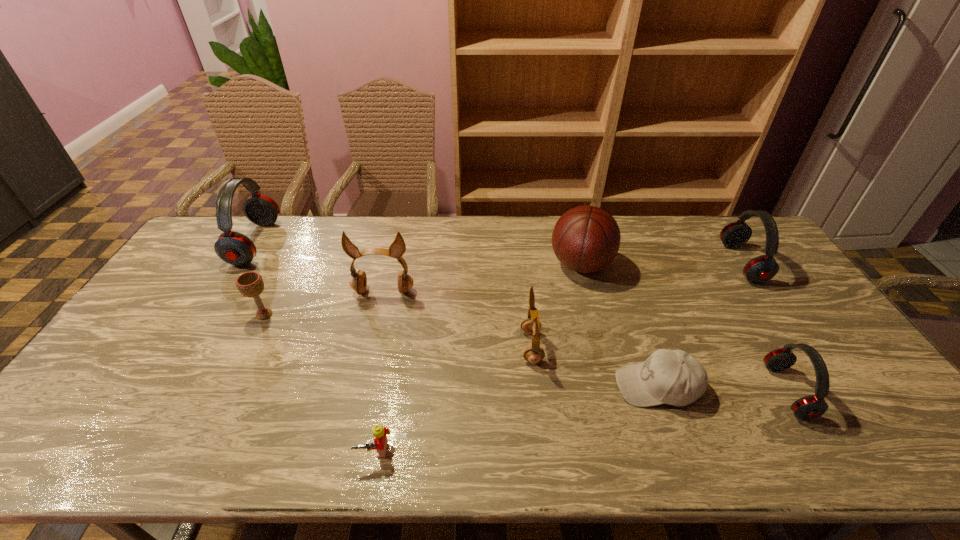
Identify the location of vacant area that lies between the Lego and the second earphone from left to right. (379, 371).

I want to click on the fourth closest object to the basketball, so pyautogui.click(x=809, y=407).

Identify the location of object that is the closest to the rightmost red earphone. The height and width of the screenshot is (540, 960). (809, 407).

Locate an element on the screen. earphone that is the second nearest to the brown basketball is located at coordinates (760, 269).

What are the coordinates of `the second closest earphone to the fifth object from right to left` in the screenshot? It's located at (809, 407).

Locate an element on the screen. The image size is (960, 540). red earphone that is the closest to the leftmost red earphone is located at coordinates (809, 407).

Point out which red earphone is positioned as the second nearest to the left brown earphone. Please provide its 2D coordinates. Your answer should be formatted as a tuple, i.e. [(x, y)], where the tuple contains the x and y coordinates of a point satisfying the conditions above.

[(809, 407)]

This screenshot has width=960, height=540. I want to click on vacant area that satisfies the following two spatial constraints: 1. on the ear cups of the basketball; 2. on the left side of the leftmost object, so click(242, 265).

Where is `free space in the image that satisfies the following two spatial constraints: 1. on the front side of the brown basketball; 2. on the front-facing side of the right brown earphone`? free space in the image that satisfies the following two spatial constraints: 1. on the front side of the brown basketball; 2. on the front-facing side of the right brown earphone is located at coordinates (602, 347).